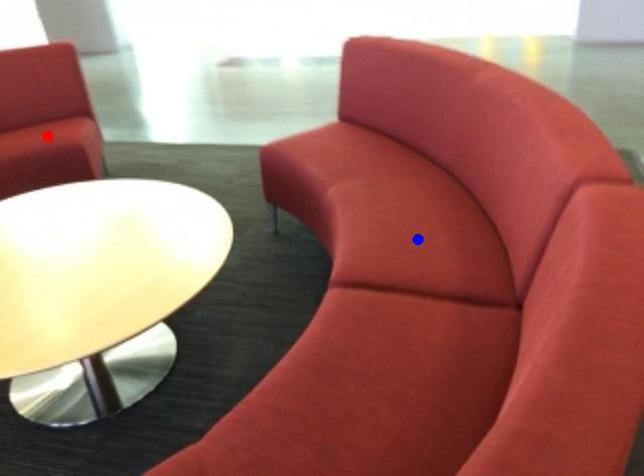
Question: Which of the two points in the image is closer to the camera?

Choices:
 (A) Blue point is closer.
 (B) Red point is closer.

Answer: (A)